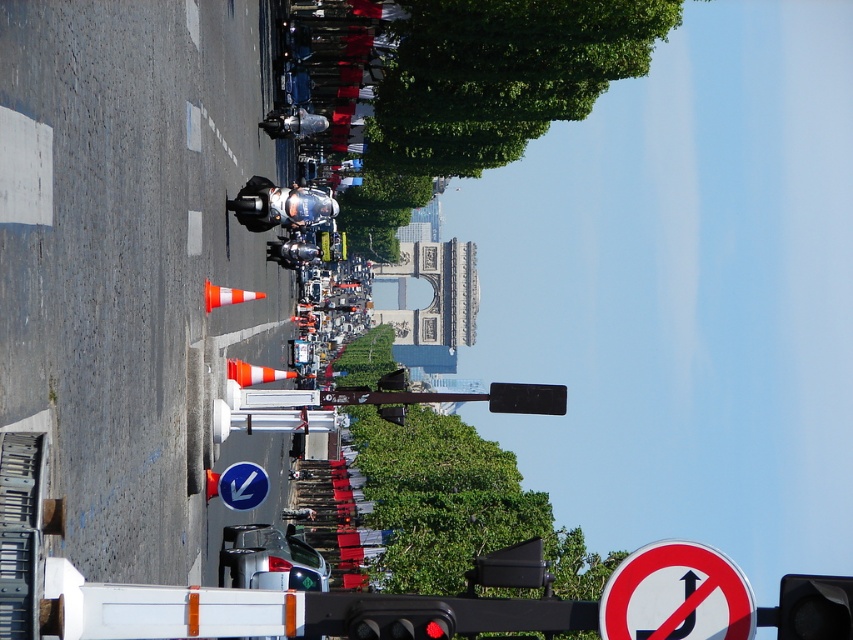
Question: Which point appears closest to the camera in this image?

Choices:
 (A) (373, 616)
 (B) (247, 492)
 (C) (778, 627)
 (D) (730, 636)

Answer: (A)

Question: Does red glass traffic light at center appear under blue plastic arrow at lower center?

Choices:
 (A) no
 (B) yes

Answer: (B)

Question: Is black plastic traffic light at center behind blue plastic arrow at lower center?

Choices:
 (A) yes
 (B) no

Answer: (B)

Question: Is the position of red glass traffic light at center more distant than that of blue plastic arrow at lower center?

Choices:
 (A) yes
 (B) no

Answer: (B)

Question: Estimate the real-world distances between objects in this image. Which object is closer to the blue plastic arrow at lower center?

Choices:
 (A) red glass traffic light at center
 (B) black plastic traffic light at center
 (C) white plastic sign at lower right

Answer: (C)

Question: Which object appears farthest from the camera in this image?

Choices:
 (A) red glass traffic light at center
 (B) black plastic traffic light at center

Answer: (A)